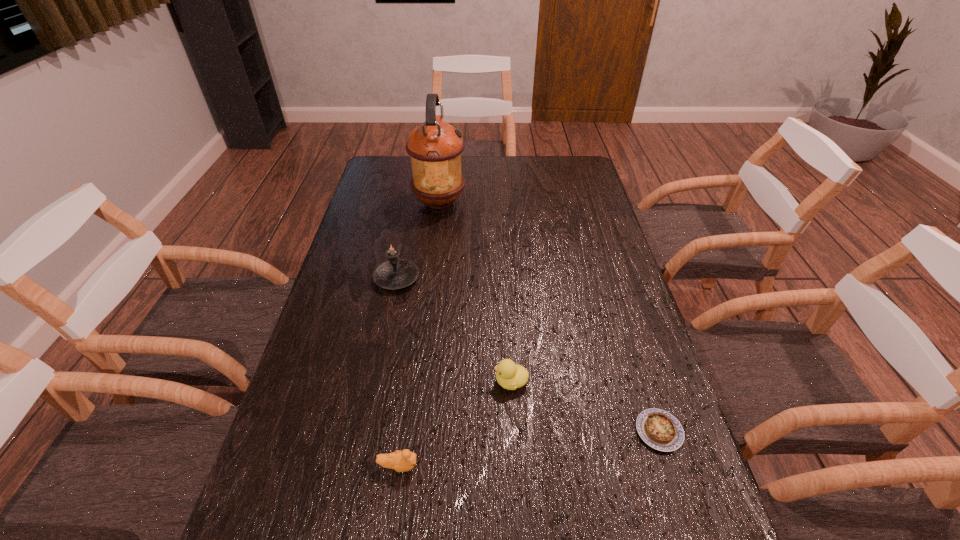
The width and height of the screenshot is (960, 540). Find the location of `the farthest object`. the farthest object is located at coordinates (435, 147).

Where is `oil lamp`? This screenshot has height=540, width=960. oil lamp is located at coordinates (435, 147).

This screenshot has width=960, height=540. In order to click on the second farthest object in this screenshot , I will do `click(395, 273)`.

Locate an element on the screen. The image size is (960, 540). candle is located at coordinates (395, 273).

The image size is (960, 540). What are the coordinates of `the third nearest object` in the screenshot? It's located at (509, 375).

Where is `the right duckling`? This screenshot has height=540, width=960. the right duckling is located at coordinates (509, 375).

Locate an element on the screen. the nearest object is located at coordinates (401, 461).

Identify the location of the fourth tallest object. The width and height of the screenshot is (960, 540). (401, 461).

Locate an element on the screen. The height and width of the screenshot is (540, 960). the second nearest object is located at coordinates (659, 429).

Find the location of `the shortest object`. the shortest object is located at coordinates (659, 429).